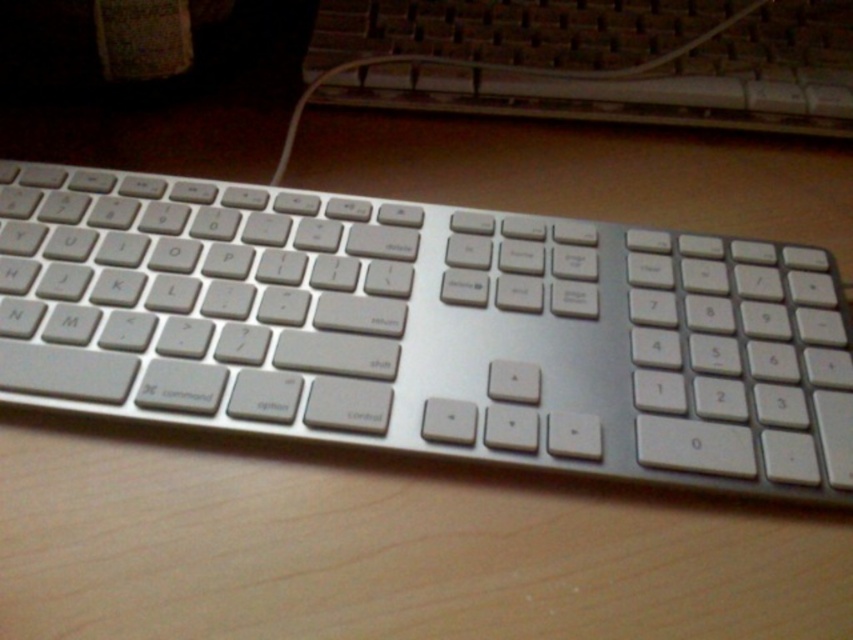
Image resolution: width=853 pixels, height=640 pixels. Describe the element at coordinates (426, 330) in the screenshot. I see `silver metallic keyboard at center` at that location.

Does silver metallic keyboard at center have a lesser height compared to satin silver keyboard at upper center?

No.

What do you see at coordinates (426, 330) in the screenshot? This screenshot has width=853, height=640. I see `silver metallic keyboard at center` at bounding box center [426, 330].

Where is `silver metallic keyboard at center`? The image size is (853, 640). silver metallic keyboard at center is located at coordinates (426, 330).